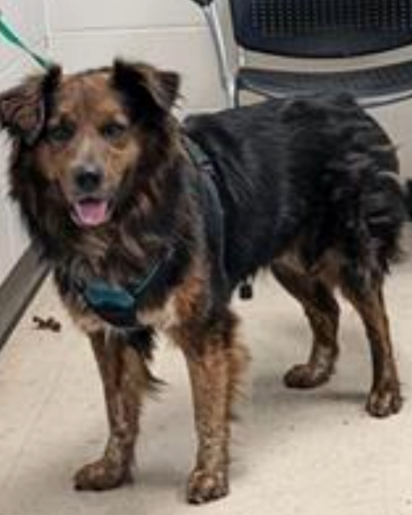
The height and width of the screenshot is (515, 412). Identify the location of chair. (266, 84).